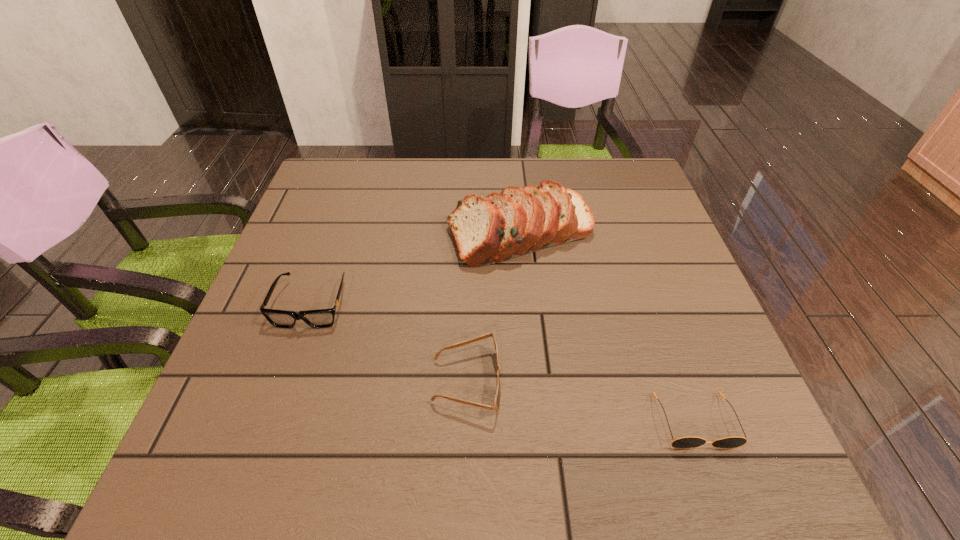
Locate an element on the screen. empty space between the bread and the second sunglasses from right to left is located at coordinates (493, 306).

Find the location of a particular element. the second closest object to the second sunglasses from left to right is located at coordinates (518, 221).

What are the coordinates of `the third closest object to the bread` in the screenshot? It's located at (685, 442).

Choose which sunglasses is the third nearest neighbor to the tallest object. Please provide its 2D coordinates. Your answer should be formatted as a tuple, i.e. [(x, y)], where the tuple contains the x and y coordinates of a point satisfying the conditions above.

[(685, 442)]

Locate which sunglasses is the closest to the shortest object. Please provide its 2D coordinates. Your answer should be formatted as a tuple, i.e. [(x, y)], where the tuple contains the x and y coordinates of a point satisfying the conditions above.

[(497, 402)]